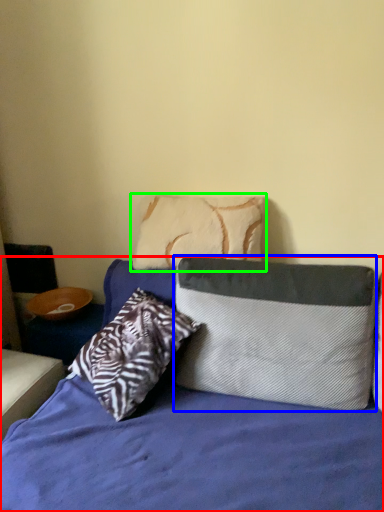
Question: Based on their relative distances, which object is nearer to bed (highlighted by a red box)? Choose from pillow (highlighted by a blue box) and pillow (highlighted by a green box).

Choices:
 (A) pillow
 (B) pillow

Answer: (A)